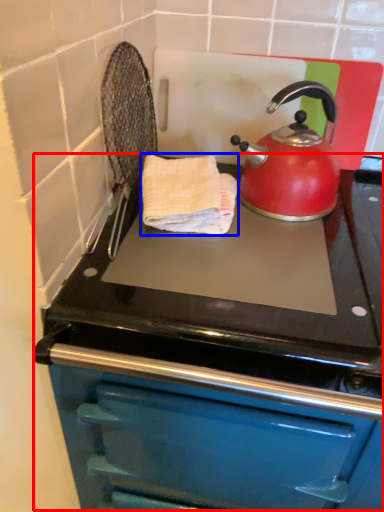
Question: Which point is closer to the camera, oven (highlighted by a red box) or hand towel (highlighted by a blue box)?

Choices:
 (A) oven
 (B) hand towel

Answer: (A)